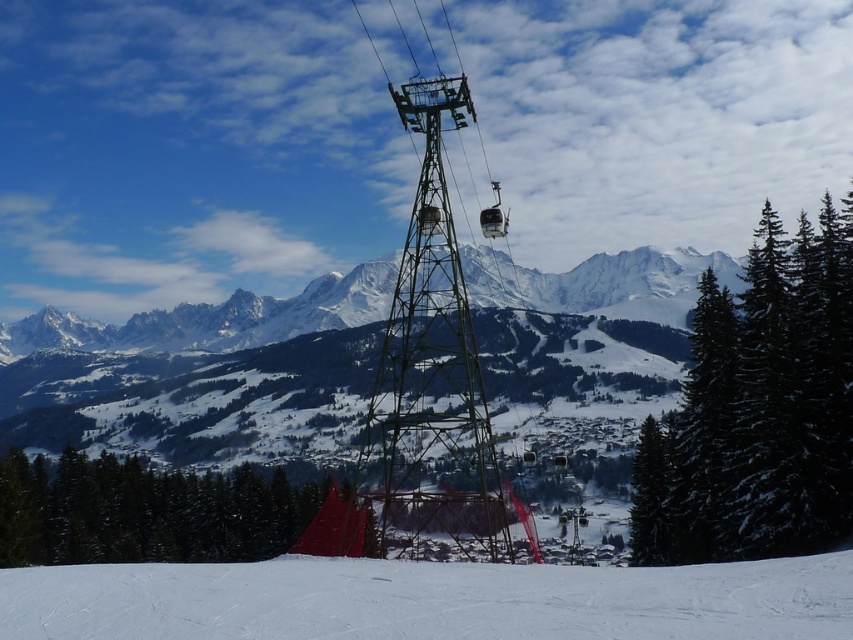
You are standing at the base of the ski slope and want to take a photo of the cable car tower. You notice two points marked in the image. The first point is at coordinates point [770,346] and the second is at point [358,472]. Which point should you focus on to ensure the cable car tower is in the foreground of your photo?

You should focus on point [770,346] because it is in front of point [358,472], making the cable car tower appear closer in the foreground.

In the scene shown: You are planning to take a photo of the winter landscape. You want to ensure both the white snow at center and the green metallic tower at center are clearly visible. Given their widths, which object will occupy more space horizontally in your photo?

The white snow at center has a greater width than the green metallic tower at center, so it will occupy more horizontal space in the photo.

You are a photographer planning to take a photo of the cable car tower. You have two points marked on your viewfinder at coordinates point (403, 624) and point (798, 547). Which point should you focus on to ensure the cable car tower is in the foreground of your photo?

You should focus on point (403, 624) because it is closer to the camera than point (798, 547), ensuring the cable car tower will be in the foreground.